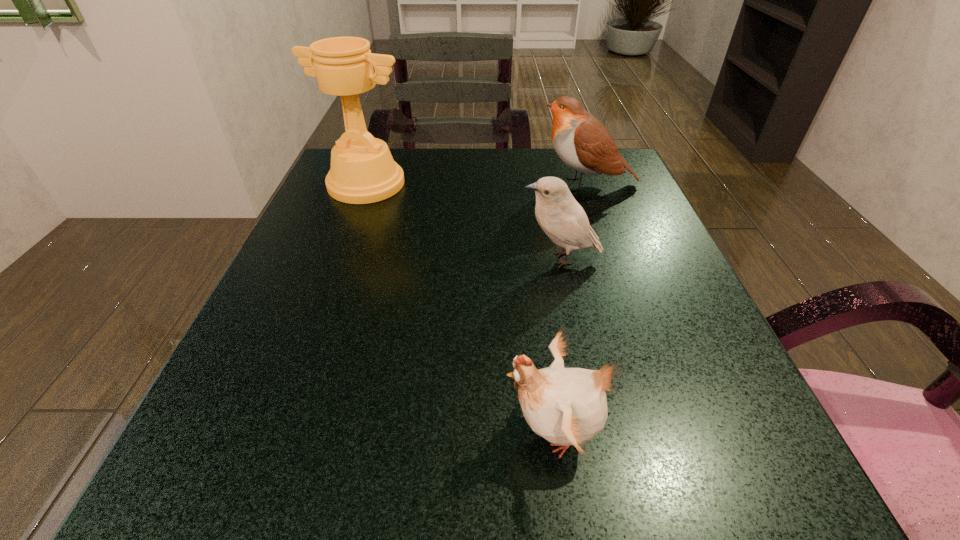
The image size is (960, 540). I want to click on vacant space positioned 0.240m at the beak of the third farthest object, so click(x=389, y=258).

Where is `vacant region located 0.150m at the beak of the third farthest object`? The height and width of the screenshot is (540, 960). vacant region located 0.150m at the beak of the third farthest object is located at coordinates (438, 258).

The image size is (960, 540). I want to click on vacant region located 0.070m at the beak of the nearest object, so click(x=447, y=431).

This screenshot has width=960, height=540. Find the location of `vacant space located 0.090m at the beak of the nearest object`. vacant space located 0.090m at the beak of the nearest object is located at coordinates (432, 431).

Find the location of a particular element. The image size is (960, 540). vacant space situated at the beak of the nearest object is located at coordinates pos(416,431).

The width and height of the screenshot is (960, 540). I want to click on award that is positioned at the far edge, so click(362, 171).

Find the location of a particular element. The width and height of the screenshot is (960, 540). bird at the far edge is located at coordinates (583, 143).

Where is `object that is at the near edge`? The width and height of the screenshot is (960, 540). object that is at the near edge is located at coordinates (567, 406).

In order to click on object that is at the left edge in this screenshot , I will do `click(362, 171)`.

Where is `object at the far left corner`? object at the far left corner is located at coordinates (362, 171).